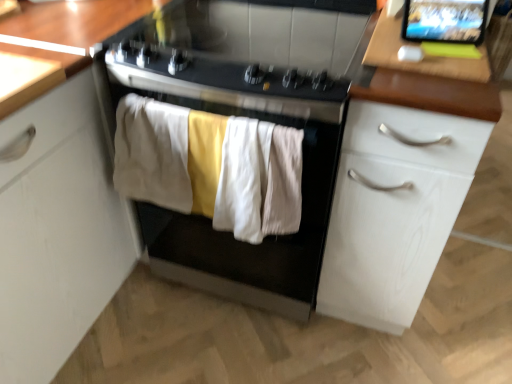
Find the location of a particular element. vacant space in front of white wood cabinet at right is located at coordinates (386, 357).